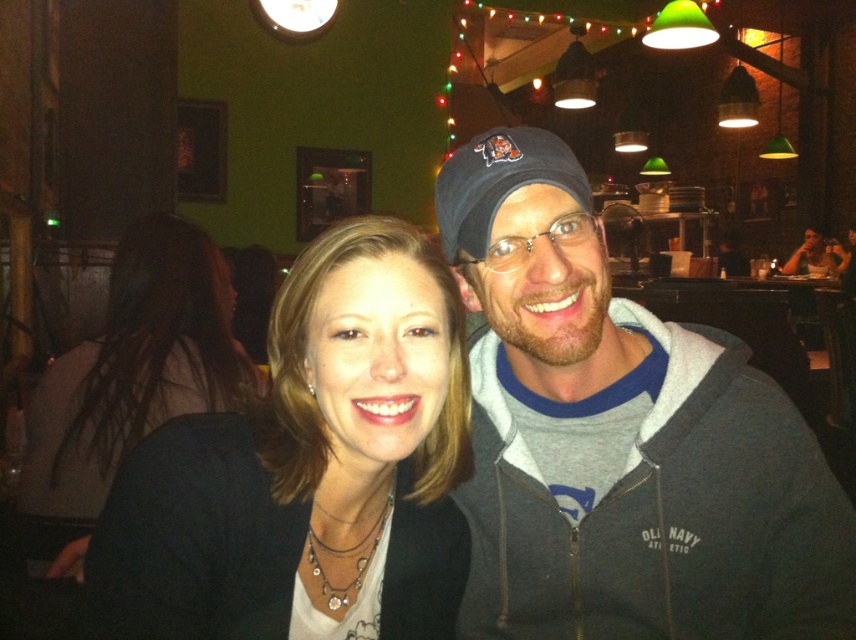
Question: In this image, where is gray fleece jacket at center located relative to matte black jacket at center?

Choices:
 (A) above
 (B) below

Answer: (A)

Question: Which point appears closest to the camera in this image?

Choices:
 (A) (241, 372)
 (B) (789, 595)
 (C) (299, 472)

Answer: (C)

Question: Based on their relative distances, which object is farther from the matte black shirt at center?

Choices:
 (A) matte gray hoodie at center
 (B) matte black jacket at center

Answer: (A)

Question: Does matte black shirt at center have a lesser width compared to matte gray hoodie at center?

Choices:
 (A) no
 (B) yes

Answer: (B)

Question: Which object is positioned closest to the matte black shirt at center?

Choices:
 (A) gray fleece jacket at center
 (B) matte black jacket at center
 (C) matte gray hoodie at center

Answer: (B)

Question: Does matte black shirt at center have a larger size compared to matte gray hoodie at center?

Choices:
 (A) yes
 (B) no

Answer: (A)